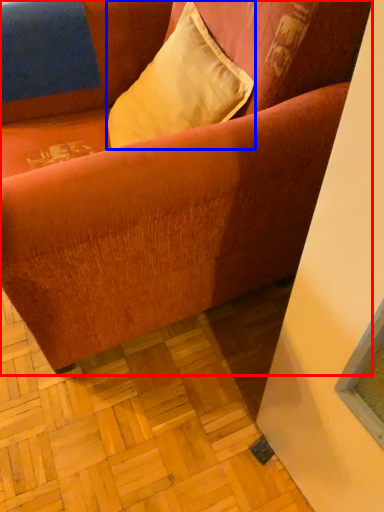
Question: Which of the following is the closest to the observer, studio couch (highlighted by a red box) or pillow (highlighted by a blue box)?

Choices:
 (A) studio couch
 (B) pillow

Answer: (A)